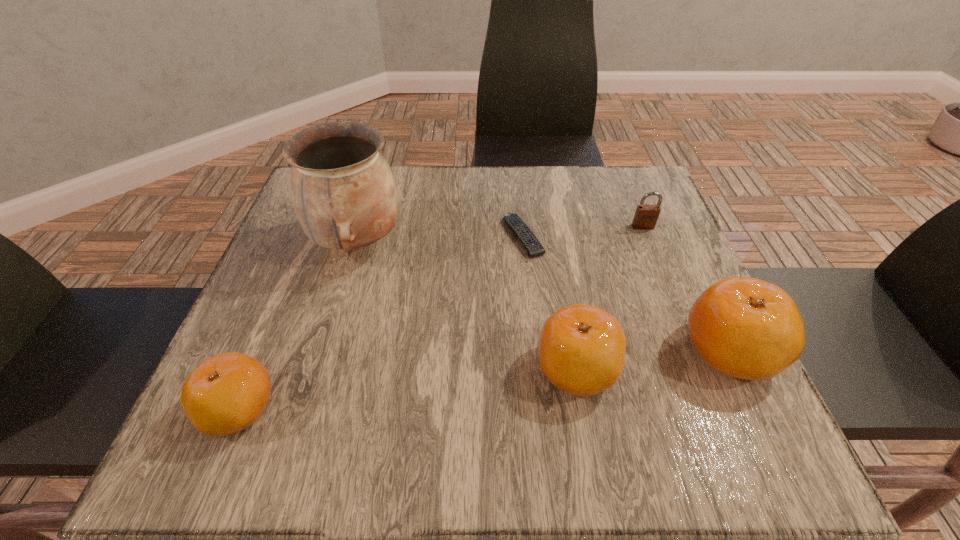
The width and height of the screenshot is (960, 540). I want to click on object present at the near left corner, so click(225, 394).

Where is `object that is at the near right corner`? The height and width of the screenshot is (540, 960). object that is at the near right corner is located at coordinates [x=747, y=328].

This screenshot has width=960, height=540. Identify the location of free space at the far edge of the desktop. (459, 171).

What are the coordinates of `free space at the near edge` in the screenshot? It's located at (353, 407).

At what (x,y) coordinates should I click in order to perform the action: click on vacant region at the left edge of the desktop. Please return your answer as a coordinate pair (x, y). The width and height of the screenshot is (960, 540). Looking at the image, I should click on (256, 356).

This screenshot has height=540, width=960. In order to click on vacant region at the right edge of the desktop in this screenshot , I will do `click(676, 312)`.

Where is `free space at the far right corner`? The width and height of the screenshot is (960, 540). free space at the far right corner is located at coordinates (631, 186).

The width and height of the screenshot is (960, 540). Find the location of `empty location between the urn and the rightmost clementine`. empty location between the urn and the rightmost clementine is located at coordinates (543, 296).

Image resolution: width=960 pixels, height=540 pixels. I want to click on free space between the second tallest clementine and the shortest object, so click(x=550, y=302).

This screenshot has height=540, width=960. I want to click on free space between the shortest object and the shortest clementine, so click(381, 322).